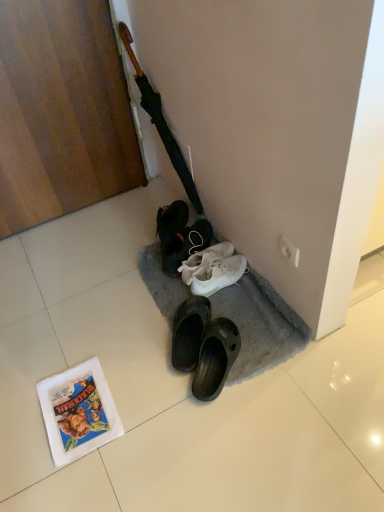
Describe the element at coordinates (78, 412) in the screenshot. I see `white paper comic book at lower left` at that location.

Where is `white paper comic book at lower left`? The image size is (384, 512). white paper comic book at lower left is located at coordinates pos(78,412).

Locate an element on the screen. white plastic power outlet at upper right is located at coordinates (289, 250).

This screenshot has height=512, width=384. Describe the element at coordinates (289, 250) in the screenshot. I see `white plastic power outlet at upper right` at that location.

Where is `white paper comic book at lower left`? This screenshot has width=384, height=512. white paper comic book at lower left is located at coordinates (78, 412).

In the scene shown: Which is more to the right, white plastic power outlet at upper right or white paper comic book at lower left?

Positioned to the right is white plastic power outlet at upper right.

Between white plastic power outlet at upper right and white paper comic book at lower left, which one is positioned behind?

white plastic power outlet at upper right is more distant.

Considering the positions of points (289, 246) and (96, 426), is point (289, 246) farther from camera compared to point (96, 426)?

Yes, it is behind point (96, 426).

From the image's perspective, which one is positioned higher, white plastic power outlet at upper right or white paper comic book at lower left?

white plastic power outlet at upper right.

From a real-world perspective, which object stands above the other?

white plastic power outlet at upper right is physically above.

Between white plastic power outlet at upper right and white paper comic book at lower left, which one has larger width?

white paper comic book at lower left is wider.

Considering the relative sizes of white plastic power outlet at upper right and white paper comic book at lower left in the image provided, is white plastic power outlet at upper right taller than white paper comic book at lower left?

Indeed, white plastic power outlet at upper right has a greater height compared to white paper comic book at lower left.

Who is bigger, white plastic power outlet at upper right or white paper comic book at lower left?

With larger size is white paper comic book at lower left.

Consider the image. Is white plastic power outlet at upper right positioned beyond the bounds of white paper comic book at lower left?

Yes, white plastic power outlet at upper right is located beyond the bounds of white paper comic book at lower left.

Is white plastic power outlet at upper right positioned far away from white paper comic book at lower left?

Actually, white plastic power outlet at upper right and white paper comic book at lower left are a little close together.

Looking at this image, is white plastic power outlet at upper right looking in the opposite direction of white paper comic book at lower left?

white plastic power outlet at upper right does not have its back to white paper comic book at lower left.

I want to click on power outlet that appears behind the white paper comic book at lower left, so click(289, 250).

Considering the relative positions of white paper comic book at lower left and white plastic power outlet at upper right in the image provided, is white paper comic book at lower left to the left or to the right of white plastic power outlet at upper right?

Clearly, white paper comic book at lower left is on the left of white plastic power outlet at upper right in the image.

Considering their positions, is white paper comic book at lower left located in front of or behind white plastic power outlet at upper right?

In the image, white paper comic book at lower left appears in front of white plastic power outlet at upper right.

Does point (65, 378) come in front of point (296, 249)?

No, (65, 378) is further to viewer.

From the image's perspective, which is above, white paper comic book at lower left or white plastic power outlet at upper right?

From the image's view, white plastic power outlet at upper right is above.

From a real-world perspective, is white paper comic book at lower left positioned over white plastic power outlet at upper right based on gravity?

Incorrect, from a real-world perspective, white paper comic book at lower left is lower than white plastic power outlet at upper right.

Does white paper comic book at lower left have a lesser width compared to white plastic power outlet at upper right?

In fact, white paper comic book at lower left might be wider than white plastic power outlet at upper right.

Between white paper comic book at lower left and white plastic power outlet at upper right, which one has less height?

A: white paper comic book at lower left is shorter.

In terms of size, does white paper comic book at lower left appear bigger or smaller than white plastic power outlet at upper right?

Considering their sizes, white paper comic book at lower left takes up more space than white plastic power outlet at upper right.

Is white paper comic book at lower left not within white plastic power outlet at upper right?

Yes, white paper comic book at lower left is located beyond the bounds of white plastic power outlet at upper right.

Is white paper comic book at lower left not close to white plastic power outlet at upper right?

No, white paper comic book at lower left is not far from white plastic power outlet at upper right.

Is white paper comic book at lower left facing away from white plastic power outlet at upper right?

No, white paper comic book at lower left is not facing away from white plastic power outlet at upper right.

How many degrees apart are the facing directions of white paper comic book at lower left and white plastic power outlet at upper right?

87.9 degrees.

Measure the distance from white paper comic book at lower left to white plastic power outlet at upper right.

white paper comic book at lower left is 79.71 centimeters away from white plastic power outlet at upper right.

Find the location of a particular element. This screenshot has height=512, width=384. power outlet above the white paper comic book at lower left (from a real-world perspective) is located at coordinates (289, 250).

The image size is (384, 512). What are the coordinates of `power outlet above the white paper comic book at lower left (from a real-world perspective)` in the screenshot? It's located at (289, 250).

Where is `comic book on the left of white plastic power outlet at upper right`? comic book on the left of white plastic power outlet at upper right is located at coordinates (78, 412).